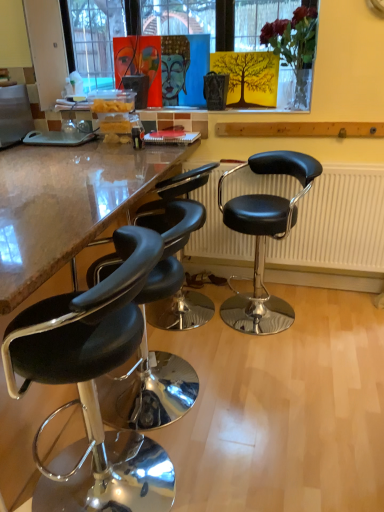
Question: From a real-world perspective, is black leather stool at left, which ranks as the 1th chair in left-to-right order, over black leather radiator at center?

Choices:
 (A) no
 (B) yes

Answer: (A)

Question: Is black leather stool at left, the 4th chair positioned from the right, facing towards black leather radiator at center?

Choices:
 (A) no
 (B) yes

Answer: (A)

Question: Considering the relative sizes of black leather stool at left, the 4th chair positioned from the right, and black leather radiator at center in the image provided, is black leather stool at left, the 4th chair positioned from the right, smaller than black leather radiator at center?

Choices:
 (A) yes
 (B) no

Answer: (B)

Question: Can you confirm if black leather stool at left, the 4th chair positioned from the right, is positioned to the left of black leather radiator at center?

Choices:
 (A) no
 (B) yes

Answer: (B)

Question: Is black leather stool at left, which ranks as the 1th chair in left-to-right order, with black leather radiator at center?

Choices:
 (A) no
 (B) yes

Answer: (A)

Question: In the image, is black leather radiator at center positioned in front of or behind black leather stool at lower left, placed as the third chair when sorted from right to left?

Choices:
 (A) behind
 (B) front

Answer: (A)

Question: Considering the positions of black leather radiator at center and black leather stool at lower left, placed as the third chair when sorted from right to left, in the image, is black leather radiator at center taller or shorter than black leather stool at lower left, placed as the third chair when sorted from right to left,?

Choices:
 (A) short
 (B) tall

Answer: (A)

Question: In the image, is black leather radiator at center on the left side or the right side of black leather stool at lower left, arranged as the second chair when viewed from the left?

Choices:
 (A) right
 (B) left

Answer: (A)

Question: From a real-world perspective, is black leather radiator at center above or below black leather stool at lower left, placed as the third chair when sorted from right to left?

Choices:
 (A) below
 (B) above

Answer: (B)

Question: Is point (102, 398) closer or farther from the camera than point (144, 222)?

Choices:
 (A) farther
 (B) closer

Answer: (B)

Question: From the image's perspective, relative to black leather stool at left, marked as the 3th chair in a left-to-right arrangement, is black leather stool at lower left, placed as the third chair when sorted from right to left, above or below?

Choices:
 (A) above
 (B) below

Answer: (B)

Question: Considering their positions, is black leather stool at lower left, placed as the third chair when sorted from right to left, located in front of or behind black leather stool at left, which is counted as the second chair, starting from the right?

Choices:
 (A) behind
 (B) front

Answer: (B)

Question: Would you say black leather stool at lower left, arranged as the second chair when viewed from the left, is inside or outside black leather stool at left, which is counted as the second chair, starting from the right?

Choices:
 (A) outside
 (B) inside

Answer: (A)

Question: Is black leather stool at lower left, placed as the third chair when sorted from right to left, in front of or behind black leather stool at right, placed as the first chair when sorted from right to left, in the image?

Choices:
 (A) behind
 (B) front

Answer: (B)

Question: From the image's perspective, is black leather stool at lower left, arranged as the second chair when viewed from the left, positioned above or below black leather stool at right, placed as the 4th chair when sorted from left to right?

Choices:
 (A) below
 (B) above

Answer: (A)